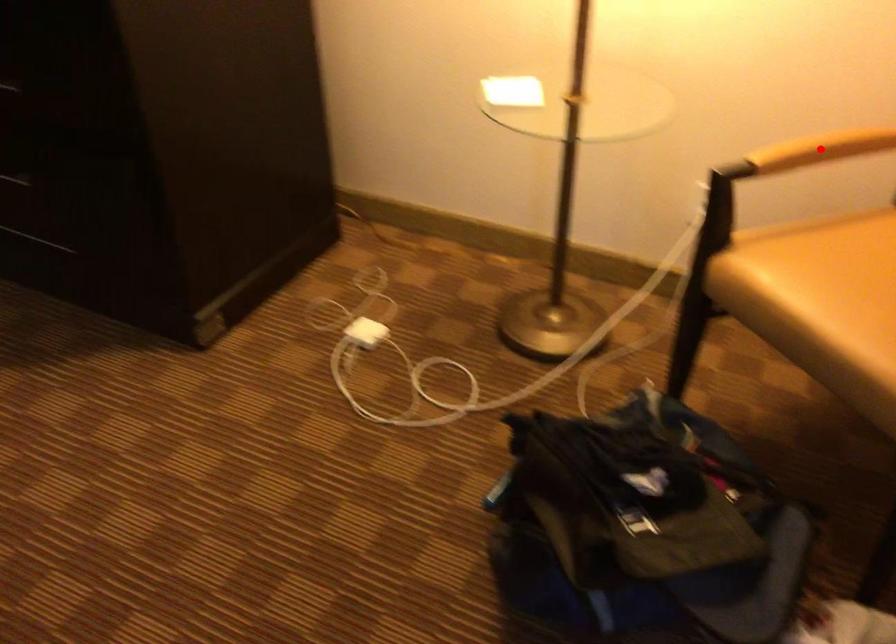
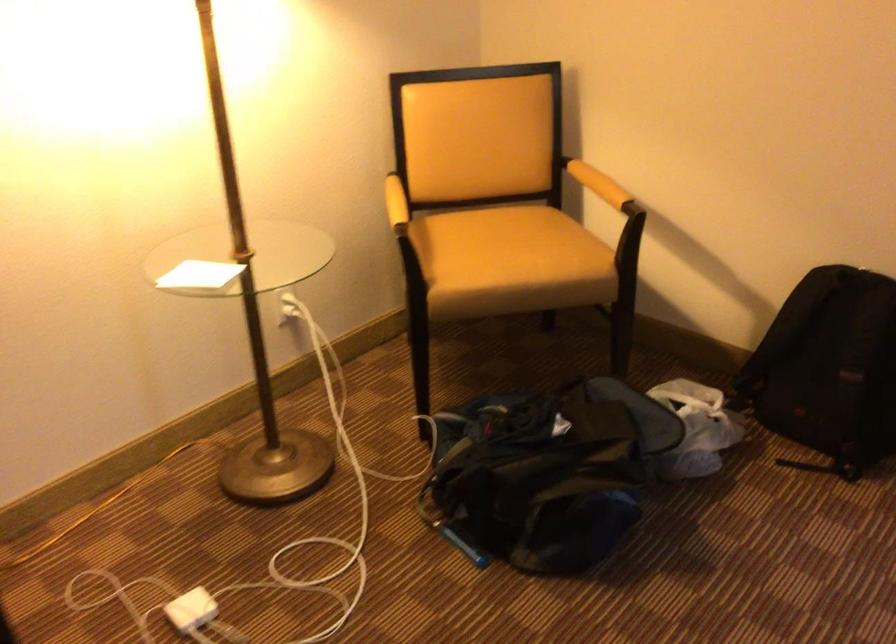
Question: I am providing you with two images of the same scene from different viewpoints. In image1, a red point is highlighted. Considering the same 3D point in image2, which of the following is correct?

Choices:
 (A) It is closer
 (B) It is farther

Answer: (B)